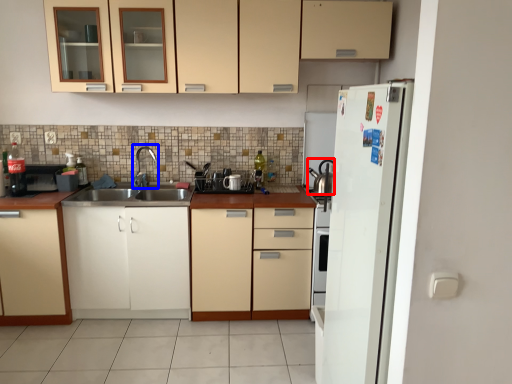
Question: Which object appears farthest to the camera in this image, tea pot (highlighted by a red box) or faucet (highlighted by a blue box)?

Choices:
 (A) tea pot
 (B) faucet

Answer: (A)